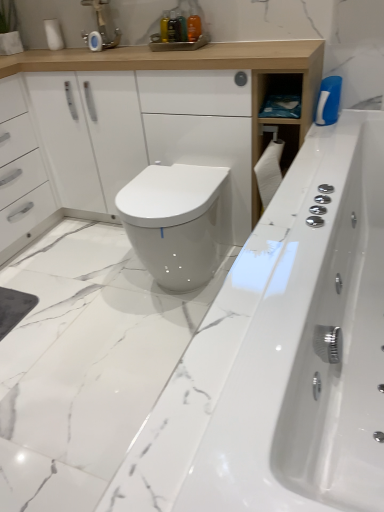
At what (x,y) coordinates should I click in order to perform the action: click on free location in front of matte silver faucet at upper center. Please return your answer as a coordinate pair (x, y). Image resolution: width=384 pixels, height=512 pixels. Looking at the image, I should click on (103, 51).